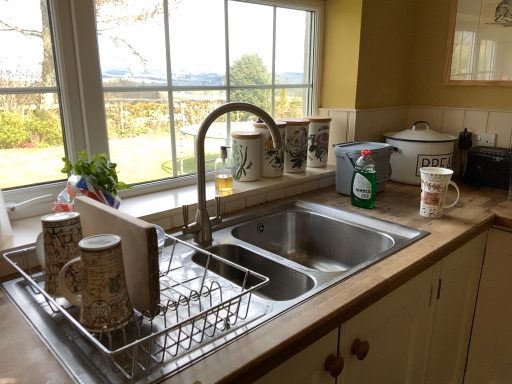
Question: From the image's perspective, is green plastic container at upper right, positioned as the 2th appliance in front-to-back order, located above or below brown ceramic mug at left, which is the 2th mug from right to left?

Choices:
 (A) above
 (B) below

Answer: (A)

Question: Is point (373, 144) closer or farther from the camera than point (86, 312)?

Choices:
 (A) closer
 (B) farther

Answer: (B)

Question: Which of these objects is positioned closest to the brushed metal faucet at center?

Choices:
 (A) transparent glass window at upper right, which is the 2th window in left-to-right order
 (B) white ceramic mug at right, placed as the 1th mug when sorted from back to front
 (C) green translucent bottle at right
 (D) brown ceramic mug at left, placed as the 1th mug when sorted from left to right
 (E) black plastic toaster at right, which is the 1th appliance from right to left

Answer: (C)

Question: Considering the real-world distances, which object is farthest from the white enamel pot at right?

Choices:
 (A) transparent glass window at upper right, which is the first window from right to left
 (B) porcelain floral canisters at upper right, the fourth appliance when ordered from front to back
 (C) brushed metal faucet at center
 (D) metallic dish rack at lower left, the 4th appliance in the right-to-left sequence
 (E) clear glass window at upper center, the 1th window from the left

Answer: (D)